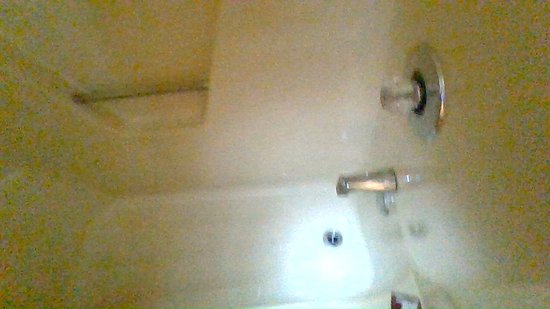
The width and height of the screenshot is (550, 309). I want to click on bottom corner tub, so click(373, 307).